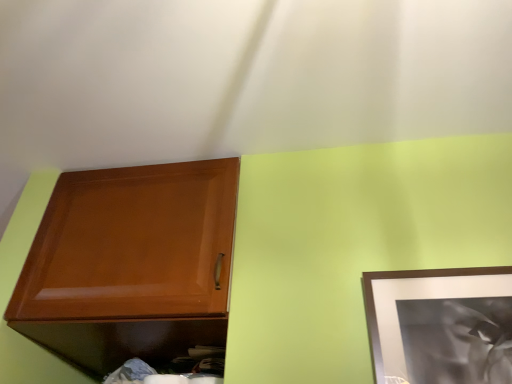
Question: In terms of height, does matte silver picture frame at upper right look taller or shorter compared to glossy wood cabinet at upper left?

Choices:
 (A) short
 (B) tall

Answer: (A)

Question: From a real-world perspective, is matte silver picture frame at upper right positioned above or below glossy wood cabinet at upper left?

Choices:
 (A) above
 (B) below

Answer: (B)

Question: In terms of size, does matte silver picture frame at upper right appear bigger or smaller than glossy wood cabinet at upper left?

Choices:
 (A) small
 (B) big

Answer: (A)

Question: From the image's perspective, relative to matte silver picture frame at upper right, is glossy wood cabinet at upper left above or below?

Choices:
 (A) below
 (B) above

Answer: (A)

Question: Considering the relative positions of glossy wood cabinet at upper left and matte silver picture frame at upper right in the image provided, is glossy wood cabinet at upper left to the left or to the right of matte silver picture frame at upper right?

Choices:
 (A) left
 (B) right

Answer: (A)

Question: Do you think glossy wood cabinet at upper left is within matte silver picture frame at upper right, or outside of it?

Choices:
 (A) inside
 (B) outside

Answer: (B)

Question: Relative to matte silver picture frame at upper right, is glossy wood cabinet at upper left in front or behind?

Choices:
 (A) front
 (B) behind

Answer: (B)